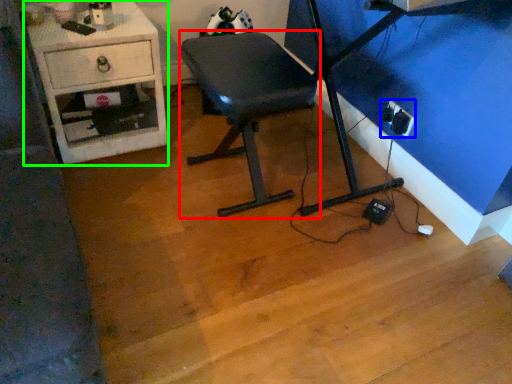
Question: Which object is the farthest from furniture (highlighted by a red box)? Choose among these: electric outlet (highlighted by a blue box) or desk (highlighted by a green box).

Choices:
 (A) electric outlet
 (B) desk

Answer: (A)